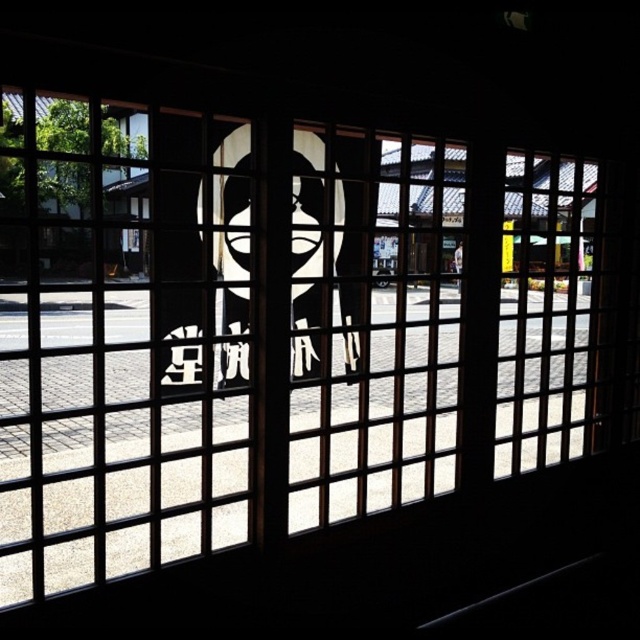
Question: Can you confirm if transparent glass door at center is positioned below translucent wood door at center?

Choices:
 (A) yes
 (B) no

Answer: (A)

Question: Can you confirm if transparent glass door at center is thinner than wooden lattice door at right?

Choices:
 (A) yes
 (B) no

Answer: (B)

Question: Which point is closer to the camera taking this photo?

Choices:
 (A) (412, 385)
 (B) (237, 509)

Answer: (B)

Question: Which object is positioned farthest from the translucent wood door at center?

Choices:
 (A) transparent glass door at center
 (B) wooden lattice door at right

Answer: (A)

Question: Which point is farther to the camera?

Choices:
 (A) wooden lattice door at right
 (B) translucent wood door at center

Answer: (A)

Question: Does transparent glass door at center have a larger size compared to wooden lattice door at right?

Choices:
 (A) yes
 (B) no

Answer: (A)